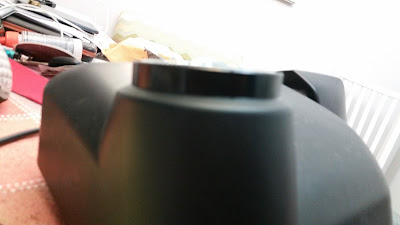
Image resolution: width=400 pixels, height=225 pixels. In order to click on plastic charger in this screenshot , I will do `click(234, 141)`.